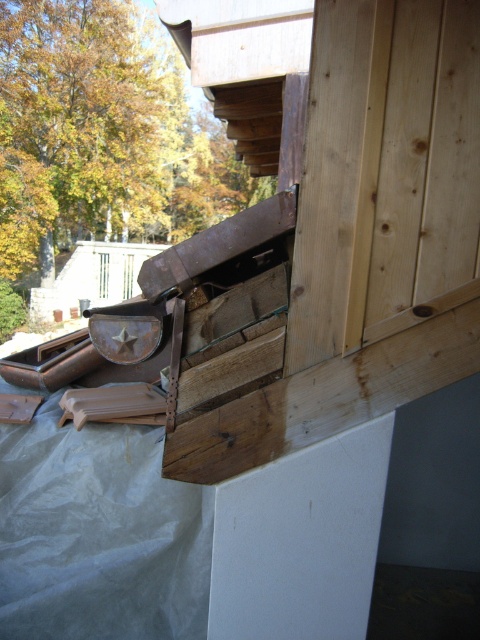
Question: Is the position of brown wood window at upper center less distant than that of transparent glass window at upper center?

Choices:
 (A) no
 (B) yes

Answer: (A)

Question: Does brown wood window at upper center appear under transparent glass window at upper center?

Choices:
 (A) no
 (B) yes

Answer: (A)

Question: Can you confirm if brown wood window at upper center is wider than transparent glass window at upper center?

Choices:
 (A) no
 (B) yes

Answer: (A)

Question: Which point appears closest to the camera in this image?

Choices:
 (A) (130, 256)
 (B) (99, 262)

Answer: (B)

Question: Which of the following is the farthest from the observer?

Choices:
 (A) (105, 266)
 (B) (126, 268)

Answer: (A)